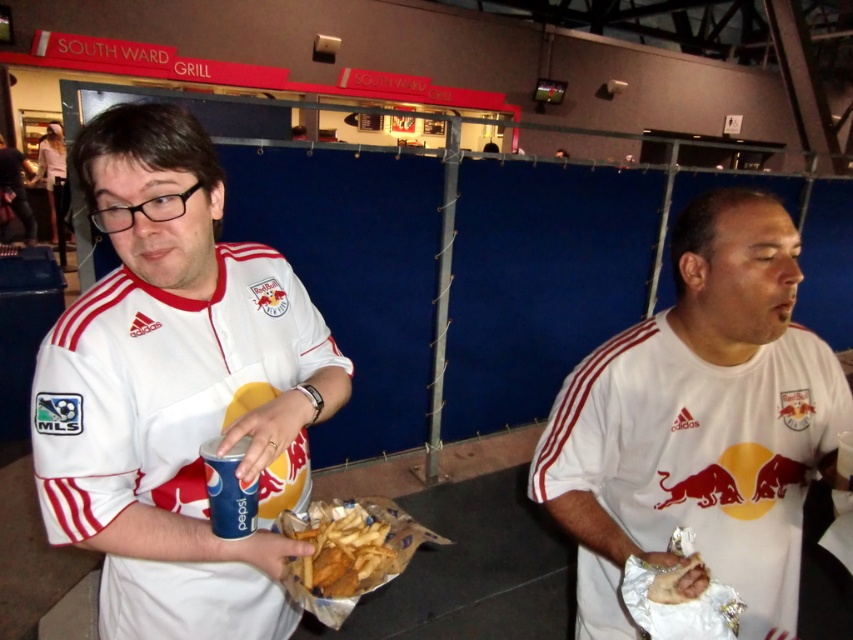
Is white matte jersey at center thinner than blue paper cup at left?

No, white matte jersey at center is not thinner than blue paper cup at left.

Is white matte jersey at center wider than blue paper cup at left?

Correct, the width of white matte jersey at center exceeds that of blue paper cup at left.

Locate an element on the screen. The image size is (853, 640). white matte jersey at center is located at coordinates (177, 388).

Does golden crispy fries at center come behind blue paper cup at left?

Yes, it is behind blue paper cup at left.

Is point (345, 595) closer to viewer compared to point (210, 449)?

No, (345, 595) is behind (210, 449).

Describe the element at coordinates (344, 550) in the screenshot. The width and height of the screenshot is (853, 640). I see `golden crispy fries at center` at that location.

In order to click on golden crispy fries at center in this screenshot , I will do [344, 550].

Who is higher up, white matte jersey at center or white matte shirt at center?

white matte jersey at center

Can you confirm if white matte jersey at center is shorter than white matte shirt at center?

Incorrect, white matte jersey at center's height does not fall short of white matte shirt at center's.

Does point (193, 486) come behind point (817, 344)?

No, it is not.

This screenshot has width=853, height=640. Identify the location of white matte jersey at center. (177, 388).